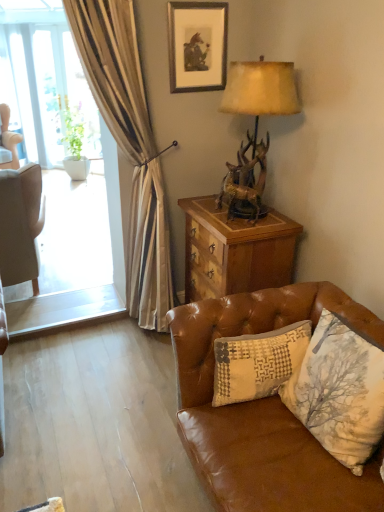
Question: Considering the relative positions of matte black picture frame at upper center and antler-patterned wood lamp at upper right in the image provided, is matte black picture frame at upper center to the left of antler-patterned wood lamp at upper right from the viewer's perspective?

Choices:
 (A) no
 (B) yes

Answer: (B)

Question: Is matte black picture frame at upper center positioned before antler-patterned wood lamp at upper right?

Choices:
 (A) no
 (B) yes

Answer: (A)

Question: From a real-world perspective, is matte black picture frame at upper center over antler-patterned wood lamp at upper right?

Choices:
 (A) no
 (B) yes

Answer: (B)

Question: Does matte black picture frame at upper center turn towards antler-patterned wood lamp at upper right?

Choices:
 (A) yes
 (B) no

Answer: (A)

Question: Is matte black picture frame at upper center completely or partially outside of antler-patterned wood lamp at upper right?

Choices:
 (A) no
 (B) yes

Answer: (B)

Question: Does matte black picture frame at upper center have a lesser height compared to antler-patterned wood lamp at upper right?

Choices:
 (A) no
 (B) yes

Answer: (B)

Question: Is matte black picture frame at upper center in front of green leafy plant at left?

Choices:
 (A) yes
 (B) no

Answer: (A)

Question: Considering the relative positions of matte black picture frame at upper center and green leafy plant at left in the image provided, is matte black picture frame at upper center to the left of green leafy plant at left from the viewer's perspective?

Choices:
 (A) no
 (B) yes

Answer: (A)

Question: Is matte black picture frame at upper center taller than green leafy plant at left?

Choices:
 (A) no
 (B) yes

Answer: (A)

Question: Considering the relative positions of matte black picture frame at upper center and green leafy plant at left in the image provided, is matte black picture frame at upper center to the right of green leafy plant at left from the viewer's perspective?

Choices:
 (A) yes
 (B) no

Answer: (A)

Question: Is matte black picture frame at upper center oriented away from green leafy plant at left?

Choices:
 (A) no
 (B) yes

Answer: (B)

Question: From a real-world perspective, is matte black picture frame at upper center under green leafy plant at left?

Choices:
 (A) yes
 (B) no

Answer: (B)

Question: Could you tell me if brown leather couch at lower right is facing antler-patterned wood lamp at upper right?

Choices:
 (A) yes
 (B) no

Answer: (B)